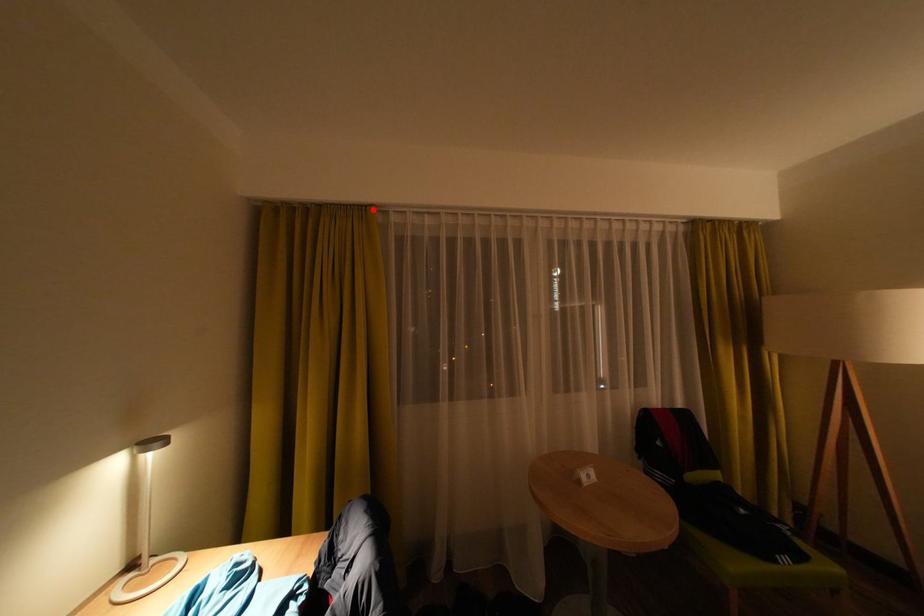
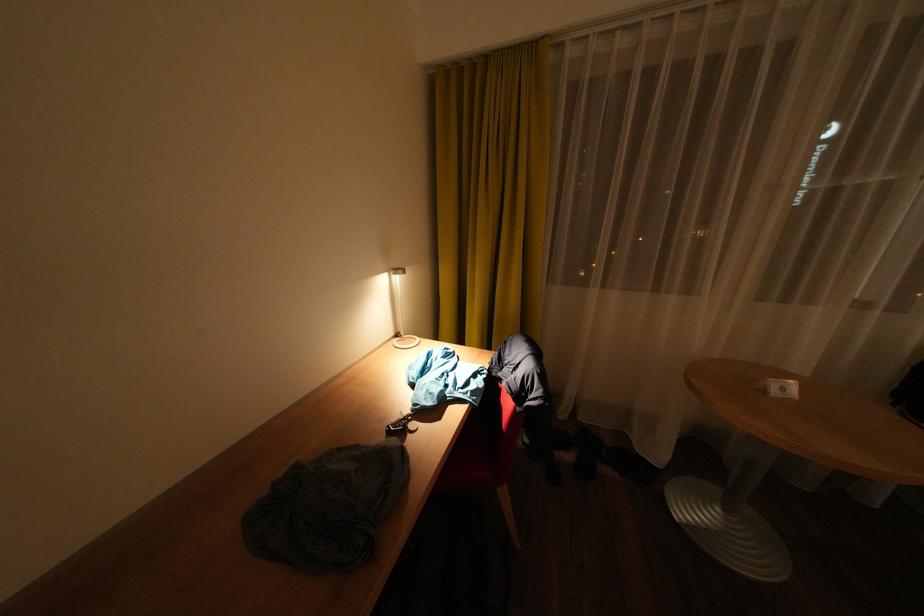
Locate, in the second image, the point that corresponds to the highlighted location in the first image.

(544, 47)